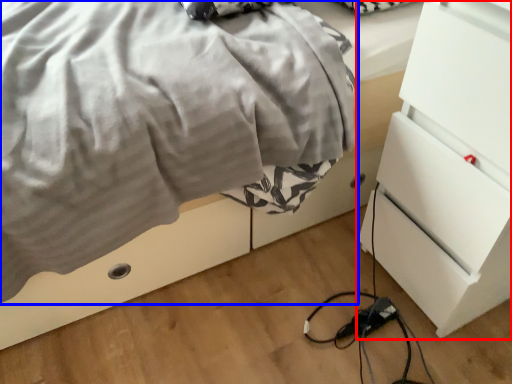
Question: Which of the following is the farthest to the observer, chest of drawers (highlighted by a red box) or blanket (highlighted by a blue box)?

Choices:
 (A) chest of drawers
 (B) blanket

Answer: (B)